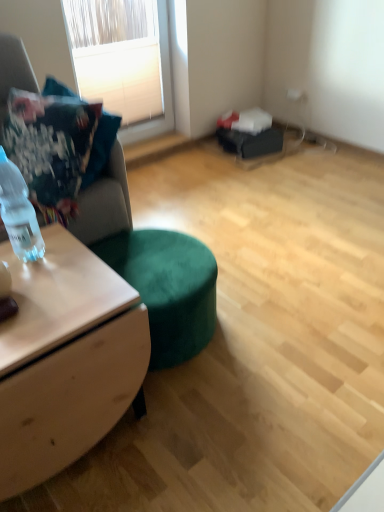
At what (x,y) coordinates should I click in order to perform the action: click on suede fabric couch at left. Please return your answer as a coordinate pair (x, y). Looking at the image, I should click on (151, 266).

What do you see at coordinates (128, 76) in the screenshot? I see `white textured blinds at upper left` at bounding box center [128, 76].

Measure the distance between point (165, 10) and camera.

Point (165, 10) is 9.51 feet from camera.

What is the approximate width of wooden desk at left?

The width of wooden desk at left is 22.69 inches.

Locate an element on the screen. wooden desk at left is located at coordinates (65, 359).

In order to click on velvet cushion at left in this screenshot , I will do `click(57, 147)`.

Locate an element on the screen. This screenshot has height=512, width=384. suede fabric couch at left is located at coordinates (151, 266).

Find the location of `studio couch above the wooden desk at left (from a real-world perspective)`. studio couch above the wooden desk at left (from a real-world perspective) is located at coordinates (151, 266).

Does point (67, 423) appear closer or farther from the camera than point (146, 263)?

Point (67, 423) is positioned closer to the camera compared to point (146, 263).

Measure the distance between wooden desk at left and suede fabric couch at left.

wooden desk at left and suede fabric couch at left are 36.59 centimeters apart from each other.

From a real-world perspective, is wooden desk at left on suede fabric couch at left?

No, from a real-world perspective, wooden desk at left is not above suede fabric couch at left.

Considering the relative sizes of wooden desk at left and velvet cushion at left in the image provided, is wooden desk at left shorter than velvet cushion at left?

Correct, wooden desk at left is not as tall as velvet cushion at left.

Is wooden desk at left next to velvet cushion at left and touching it?

wooden desk at left is not next to velvet cushion at left, and they're not touching.

From a real-world perspective, is wooden desk at left located higher than velvet cushion at left?

Actually, wooden desk at left is physically below velvet cushion at left in the real world.

Considering the sizes of wooden desk at left and velvet cushion at left in the image, is wooden desk at left wider or thinner than velvet cushion at left?

wooden desk at left is wider than velvet cushion at left.

Is clear plastic bottle at left shorter than velvet cushion at left?

Indeed, clear plastic bottle at left has a lesser height compared to velvet cushion at left.

Is clear plastic bottle at left thinner than velvet cushion at left?

Yes, clear plastic bottle at left is thinner than velvet cushion at left.

From the image's perspective, is clear plastic bottle at left located above or below velvet cushion at left?

clear plastic bottle at left is situated lower than velvet cushion at left in the image.

Is clear plastic bottle at left oriented towards velvet cushion at left?

No, clear plastic bottle at left is not turned towards velvet cushion at left.

From a real-world perspective, which object stands above the other?

velvet cushion at left is physically above.

What's the angular difference between velvet cushion at left and wooden desk at left's facing directions?

67.4 degrees.

Considering the sizes of objects velvet cushion at left and wooden desk at left in the image provided, who is bigger, velvet cushion at left or wooden desk at left?

With larger size is wooden desk at left.

Considering the positions of point (119, 202) and point (54, 311), is point (119, 202) closer or farther from the camera than point (54, 311)?

Clearly, point (119, 202) is more distant from the camera than point (54, 311).

Which object is closer to the camera taking this photo, suede fabric couch at left or wooden desk at left?

wooden desk at left is more forward.

From a real-world perspective, is suede fabric couch at left physically above wooden desk at left?

Yes, from a real-world perspective, suede fabric couch at left is over wooden desk at left

Is suede fabric couch at left facing away from velvet cushion at left?

That's right, suede fabric couch at left is facing away from velvet cushion at left.

Is suede fabric couch at left further to camera compared to velvet cushion at left?

No, suede fabric couch at left is in front of velvet cushion at left.

From the image's perspective, is suede fabric couch at left below velvet cushion at left?

Yes, from the image's perspective, suede fabric couch at left is below velvet cushion at left.

Looking at the image, does suede fabric couch at left seem bigger or smaller compared to velvet cushion at left?

Clearly, suede fabric couch at left is larger in size than velvet cushion at left.

Is point (20, 437) closer or farther from the camera than point (5, 224)?

Point (20, 437) appears to be closer to the viewer than point (5, 224).

The image size is (384, 512). I want to click on desk in front of the clear plastic bottle at left, so click(65, 359).

Considering the relative positions of wooden desk at left and clear plastic bottle at left in the image provided, is wooden desk at left to the left of clear plastic bottle at left from the viewer's perspective?

In fact, wooden desk at left is to the right of clear plastic bottle at left.

Identify the location of studio couch on the left of wooden desk at left. (151, 266).

Locate an element on the screen. The width and height of the screenshot is (384, 512). desk on the right of velvet cushion at left is located at coordinates (65, 359).

Considering their positions, is white textured blinds at upper left positioned further to suede fabric couch at left than velvet cushion at left?

Based on the image, white textured blinds at upper left appears to be further to suede fabric couch at left.

Looking at the image, which one is located further to white textured blinds at upper left, velvet cushion at left or clear plastic bottle at left?

The object further to white textured blinds at upper left is clear plastic bottle at left.

Estimate the real-world distances between objects in this image. Which object is closer to velvet cushion at left, clear plastic bottle at left or wooden desk at left?

Among the two, clear plastic bottle at left is located nearer to velvet cushion at left.

When comparing their distances from wooden desk at left, does clear plastic bottle at left or velvet cushion at left seem further?

Among the two, velvet cushion at left is located further to wooden desk at left.

Consider the image. Which object lies further to the anchor point clear plastic bottle at left, white textured blinds at upper left or suede fabric couch at left?

The object further to clear plastic bottle at left is white textured blinds at upper left.

Based on their spatial positions, is suede fabric couch at left or velvet cushion at left closer to wooden desk at left?

Among the two, suede fabric couch at left is located nearer to wooden desk at left.

When comparing their distances from clear plastic bottle at left, does white textured blinds at upper left or velvet cushion at left seem closer?

Based on the image, velvet cushion at left appears to be nearer to clear plastic bottle at left.

Considering their positions, is suede fabric couch at left positioned closer to velvet cushion at left than white textured blinds at upper left?

suede fabric couch at left.

In order to click on pillow positioned between wooden desk at left and white textured blinds at upper left from near to far in this screenshot , I will do tap(57, 147).

Locate an element on the screen. pillow positioned between clear plastic bottle at left and white textured blinds at upper left from near to far is located at coordinates (57, 147).

You are a GUI agent. You are given a task and a screenshot of the screen. Output one action in this format:
    pyautogui.click(x=<x>, y=<y>)
    Task: Click on the bottle between velvet cushion at left and wooden desk at left from top to bottom
    
    Given the screenshot: What is the action you would take?
    pyautogui.click(x=18, y=212)

You are a GUI agent. You are given a task and a screenshot of the screen. Output one action in this format:
    pyautogui.click(x=<x>, y=<y>)
    Task: Click on the studio couch between clear plastic bottle at left and white textured blinds at upper left from front to back
    Image resolution: width=384 pixels, height=512 pixels.
    Given the screenshot: What is the action you would take?
    point(151,266)